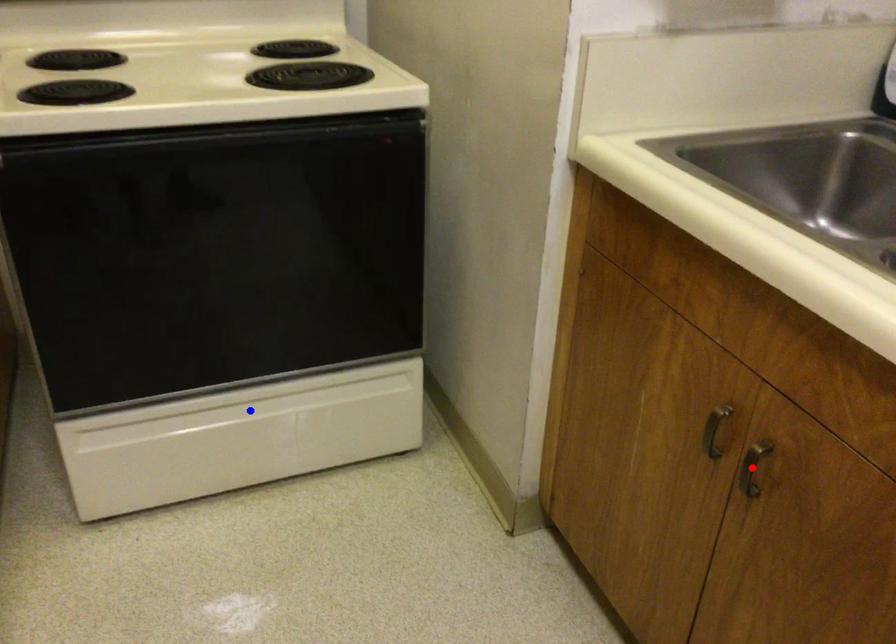
Question: In the image, two points are highlighted. Which point is nearer to the camera? Reply with the corresponding letter.

Choices:
 (A) blue point
 (B) red point

Answer: (B)